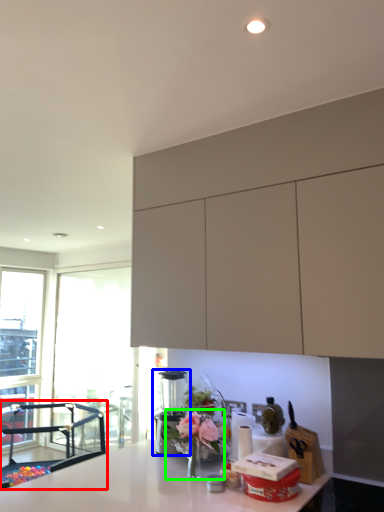
Question: Which object is the farthest from chair (highlighted by a red box)? Choose among these: coffee machine (highlighted by a blue box) or floral arrangement (highlighted by a green box).

Choices:
 (A) coffee machine
 (B) floral arrangement

Answer: (B)